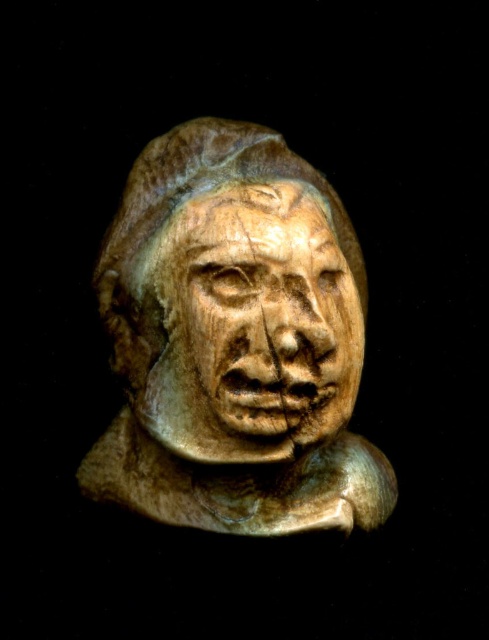
Is matte stone bust at center further to camera compared to wooden carving at center?

Yes, matte stone bust at center is further from the viewer.

Who is higher up, matte stone bust at center or wooden carving at center?

wooden carving at center

Find the location of a particular element. The image size is (489, 640). matte stone bust at center is located at coordinates (236, 340).